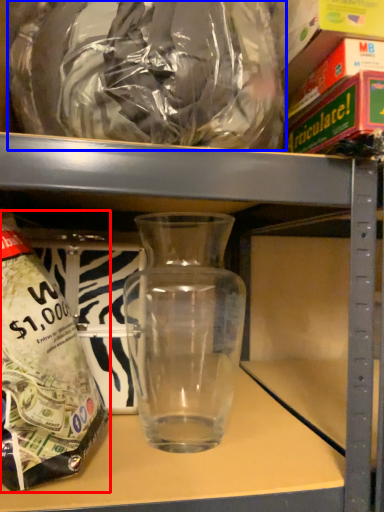
Question: Among these objects, which one is nearest to the camera, bottle (highlighted by a red box) or plastic bag (highlighted by a blue box)?

Choices:
 (A) bottle
 (B) plastic bag

Answer: (B)